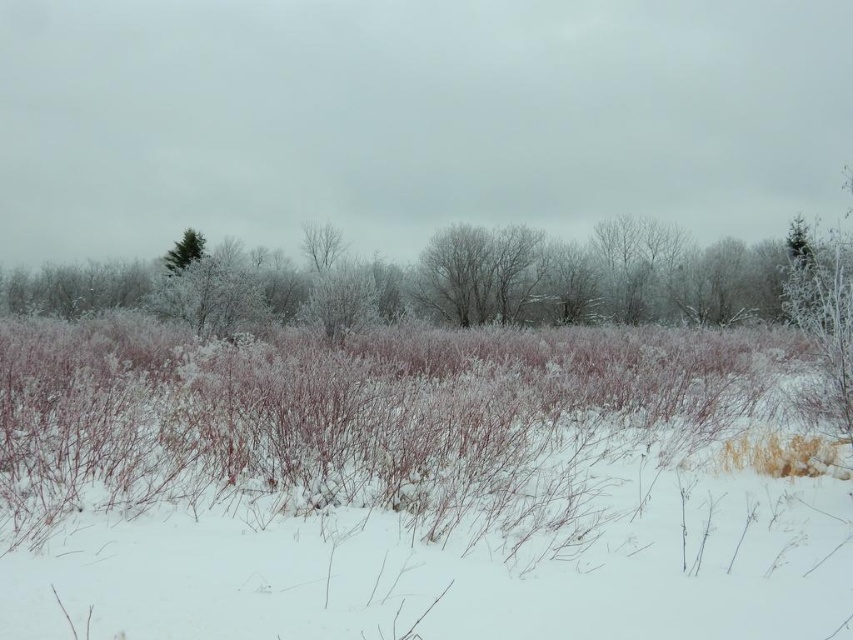
From the picture: You are standing in the winter landscape and want to walk from the point closer to the camera to the point further away. Which path would you take between the two points, point (453,275) and point (189,230)?

You should walk towards point (189,230) because it is further away from the camera compared to point (453,275), which is closer.

You are an observer standing in the winter landscape. You notice two frosty elements in the scene. Which one is taller between the frosty branches at center and the frosty bark tree at center?

The frosty branches at center is much taller than the frosty bark tree at center according to the description.

In the scene shown: You are an artist trying to sketch the winter scene. You notice the frosty branches at center and the frosty bark tree at center. Which object should you draw first if you want to capture the wider element first?

The frosty branches at center are wider than the frosty bark tree at center, so you should draw the frosty branches at center first.